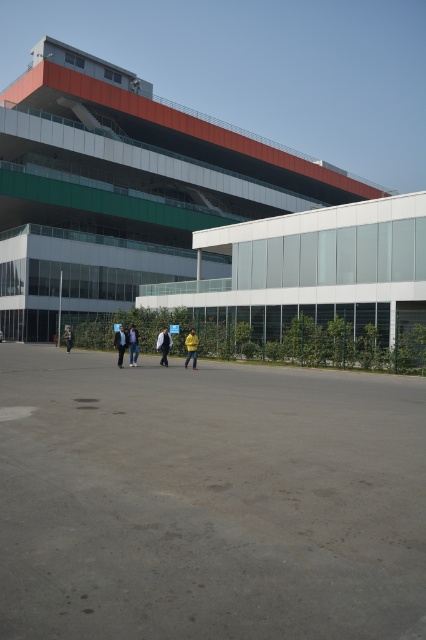
You are standing at the entrance of the building and want to greet the person wearing the yellow fabric jacket at center. In which direction should you walk from the entrance to reach them?

The yellow fabric jacket at center is located at point (164, 344) in the image, so you should walk towards the center of the image to reach them.

Based on the photo, you are an event planner organizing a photoshoot in front of the modern building. You need to position two models wearing the yellow matte jacket at center and the yellow fabric jacket at center. Since both jackets are yellow, you want to highlight their differences in length. Where should you place each model to best showcase their jacket lengths?

Place the model wearing the yellow matte jacket at center closer to the camera and the model wearing the yellow fabric jacket at center further away. This way, the shorter yellow matte jacket at center will appear proportionally longer when closer, while the longer yellow fabric jacket at center will look appropriately longer when viewed from a distance, emphasizing their length differences.